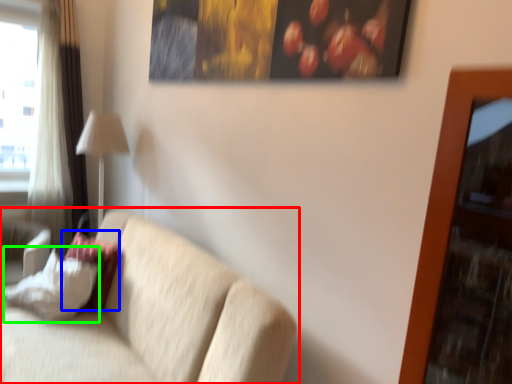
Question: Which object is positioned farthest from studio couch (highlighted by a red box)? Select from pillow (highlighted by a blue box) and pillow (highlighted by a green box).

Choices:
 (A) pillow
 (B) pillow

Answer: (A)